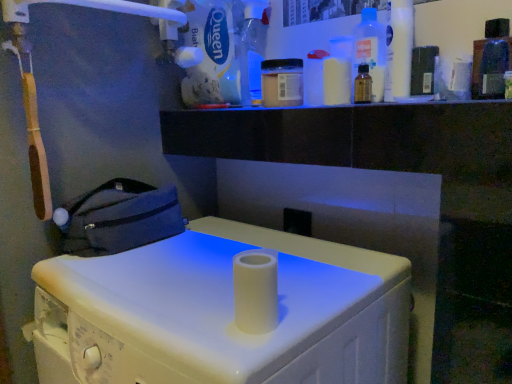
The height and width of the screenshot is (384, 512). I want to click on vacant area that is in front of dark blue fabric bag at left, so click(x=119, y=270).